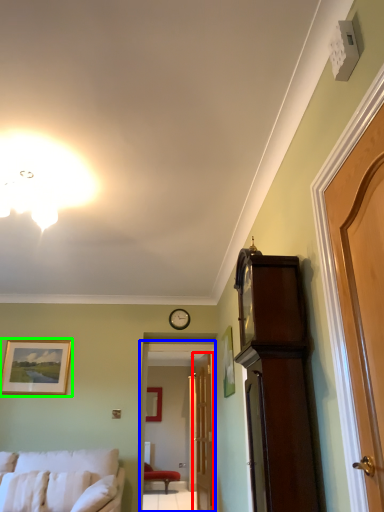
Question: Which object is the closest to the door (highlighted by a red box)? Choose among these: glass door (highlighted by a blue box) or picture frame (highlighted by a green box).

Choices:
 (A) glass door
 (B) picture frame

Answer: (A)